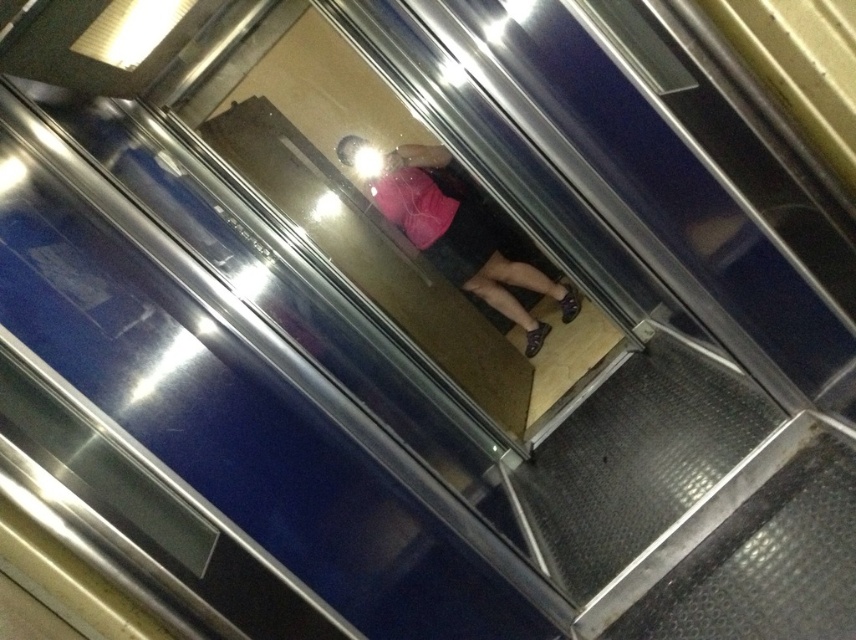
You are standing at the bottom of the metallic textured stair at lower right and want to take a photo of the person reflected in the train door. Based on the reflection, where should you position yourself to capture the best view of the person?

The metallic textured stair at lower right is located at point (634, 460), so you should position yourself near that location to capture the best view of the person reflected in the train door.

You are a passenger on a train and want to place your bag on the metallic textured stair at lower right. The bag is as wide as the pink matte shirt at center. Will the bag fit on the stair?

The metallic textured stair at lower right is narrower than the pink matte shirt at center. Since the bag is as wide as the pink matte shirt at center, it will not fit on the stair.

You are standing in front of a reflective train door and see the metallic textured stair at lower right and the pink matte shirt at center in the reflection. Which object is positioned lower in the reflection?

The metallic textured stair at lower right is located below the pink matte shirt at center in the reflection, so it is positioned lower.